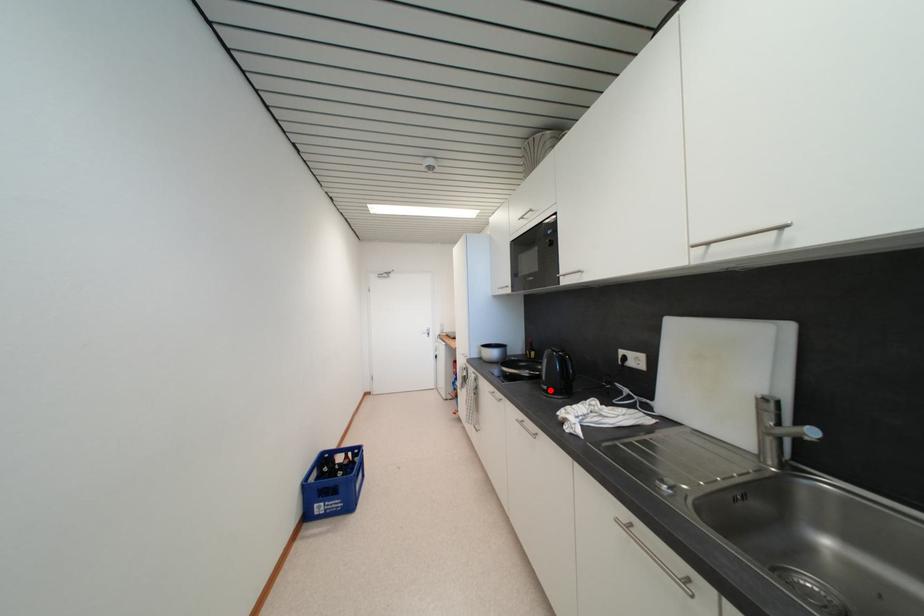
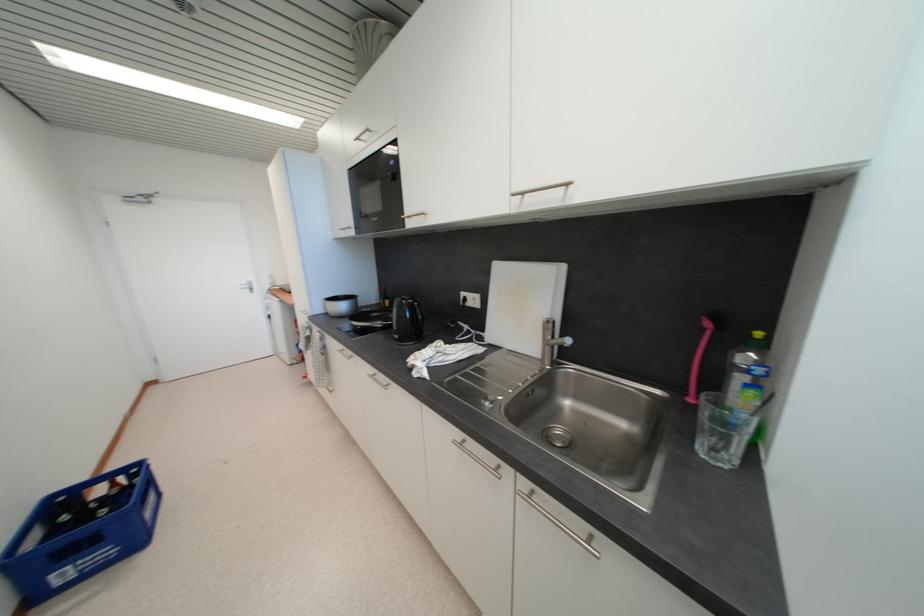
The point at the highlighted location is marked in the first image. Where is the corresponding point in the second image?

(402, 339)